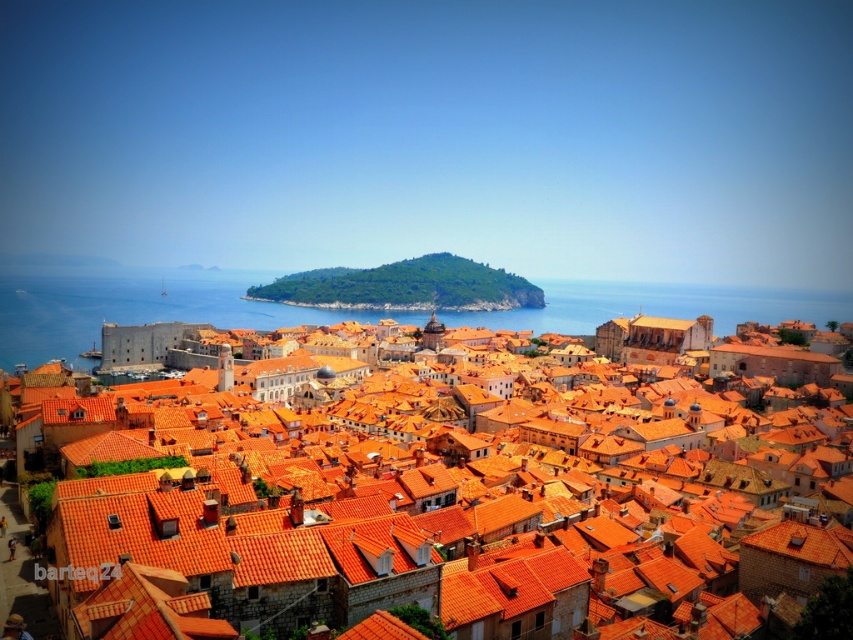
Question: From the image, what is the correct spatial relationship of orange clay rooftops at center in relation to green leafy hillside at center?

Choices:
 (A) right
 (B) left

Answer: (A)

Question: Can you confirm if orange clay rooftops at center is positioned above blue water at center?

Choices:
 (A) no
 (B) yes

Answer: (A)

Question: Which of the following is the closest to the observer?

Choices:
 (A) [x=735, y=289]
 (B) [x=463, y=288]
 (C) [x=495, y=536]

Answer: (C)

Question: Does orange clay rooftops at center appear under green leafy hillside at center?

Choices:
 (A) yes
 (B) no

Answer: (A)

Question: Which point is closer to the camera taking this photo?

Choices:
 (A) (717, 326)
 (B) (166, 490)

Answer: (B)

Question: Which object is positioned farthest from the orange clay rooftops at center?

Choices:
 (A) green leafy hillside at center
 (B) blue water at center

Answer: (A)